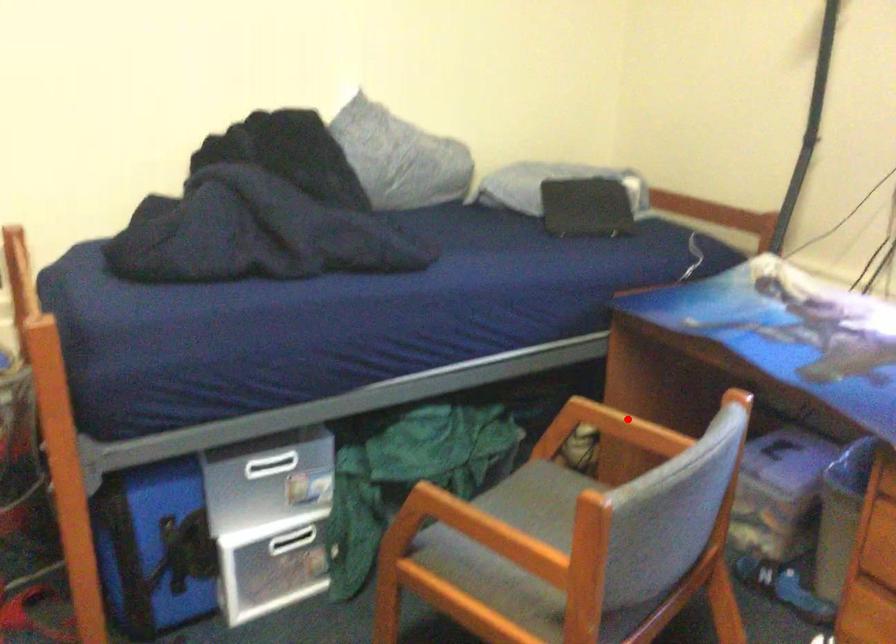
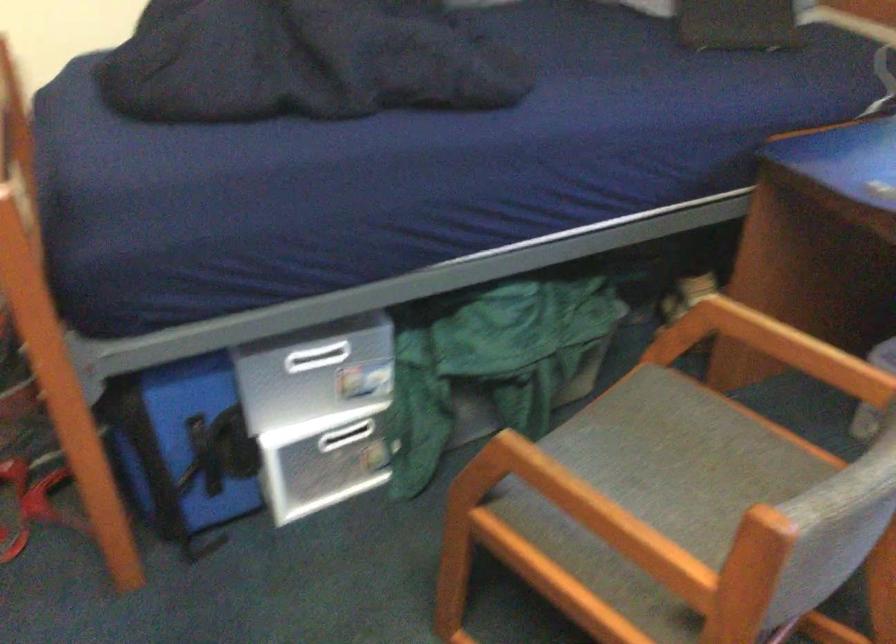
Question: I am providing you with two images of the same scene from different viewpoints. Image1 has a red point marked. In image2, the corresponding 3D location appears at what relative position? Reply with the corresponding letter.

Choices:
 (A) Closer
 (B) Farther

Answer: (A)